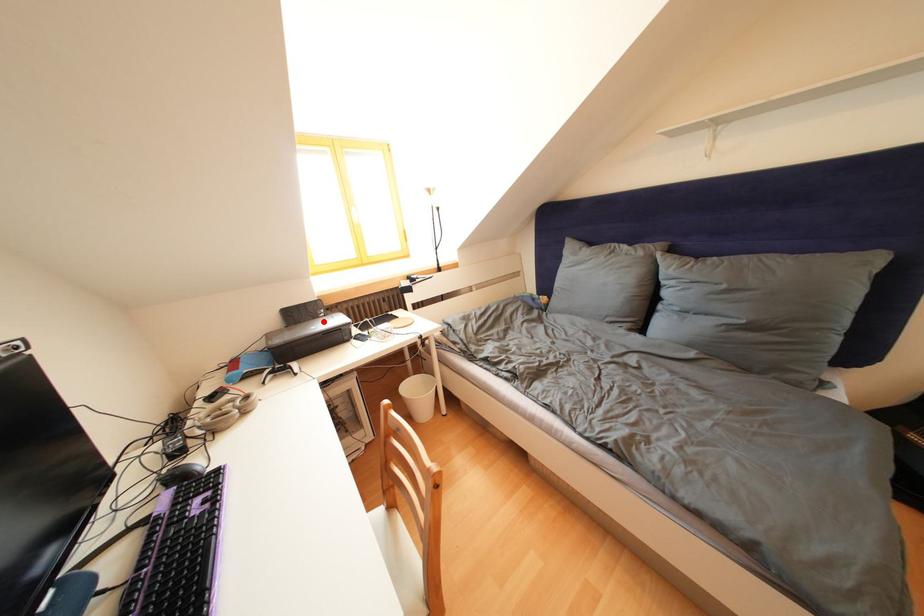
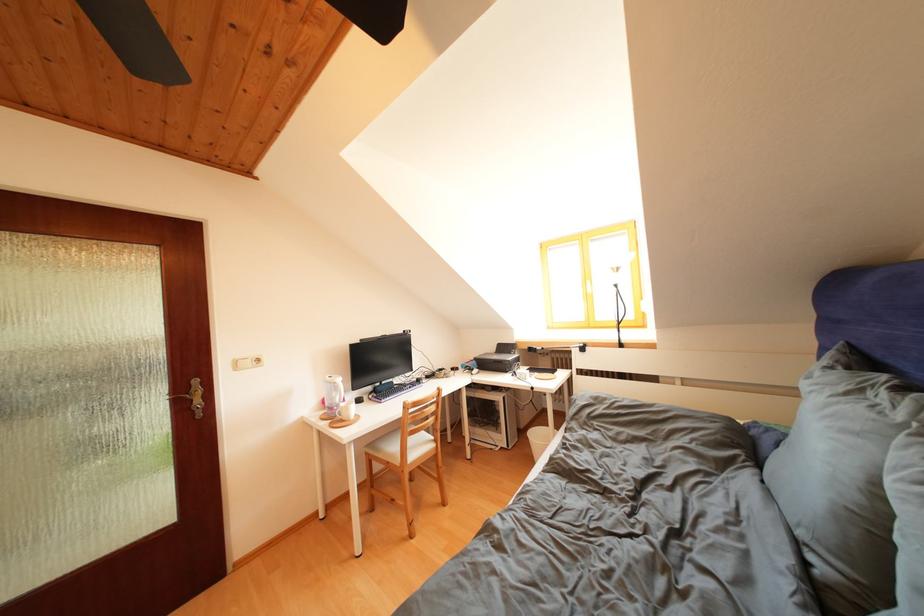
Locate, in the second image, the point that corresponds to the highlighted location in the first image.

(517, 358)